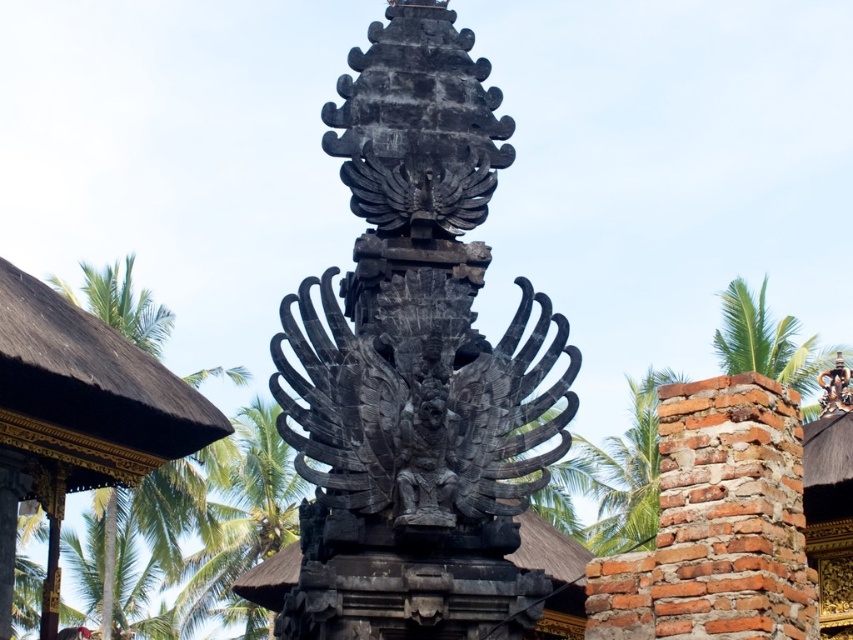
You are an archaeologist examining the stone structure. You notice the black stone statue at center and the golden textured roof at left. Which object is positioned closer to your current viewpoint?

The black stone statue at center is closer to the viewer than the golden textured roof at left.

You are an architect analyzing the proportions of this temple structure. Based on the image, which object, the black stone statue at center or the golden textured roof at left, would require more materials to construct due to its size?

The black stone statue at center is bigger than the golden textured roof at left, so it would require more materials to construct due to its larger size.